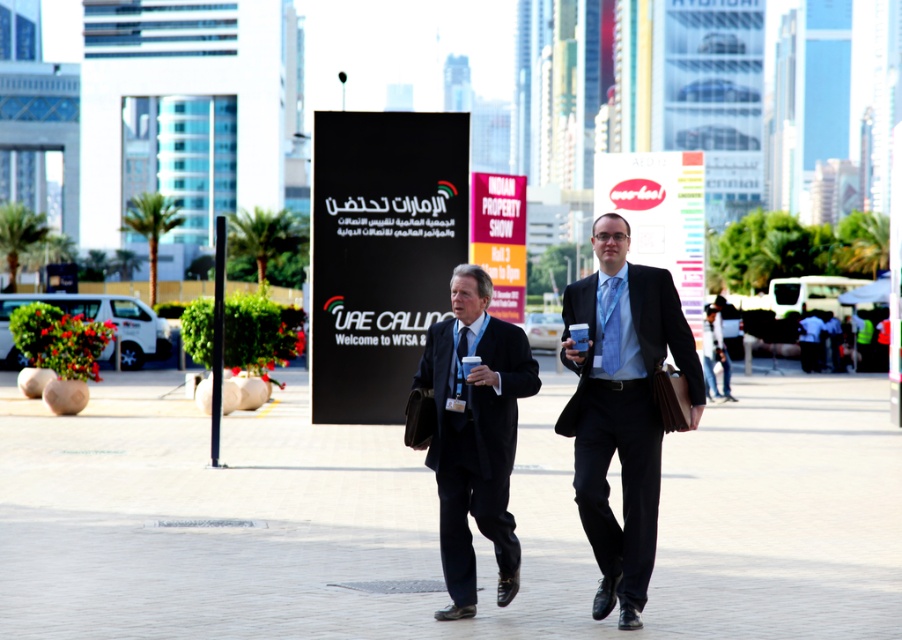
Who is positioned more to the right, matte black suit at center or matte white sign at center?

matte white sign at center

The width and height of the screenshot is (902, 640). Find the location of `matte black suit at center`. matte black suit at center is located at coordinates point(622,406).

Find the location of `matte black suit at center`. matte black suit at center is located at coordinates (622, 406).

Is point (379, 161) positioned after point (502, 548)?

Yes, point (379, 161) is behind point (502, 548).

Is point (346, 326) positioned before point (429, 356)?

No, (346, 326) is behind (429, 356).

What are the coordinates of `black plastic sign at center` in the screenshot? It's located at (380, 253).

Can you confirm if gray concrete pavement at center is shorter than matte white sign at center?

Yes, gray concrete pavement at center is shorter than matte white sign at center.

Locate an element on the screen. This screenshot has width=902, height=640. gray concrete pavement at center is located at coordinates (261, 525).